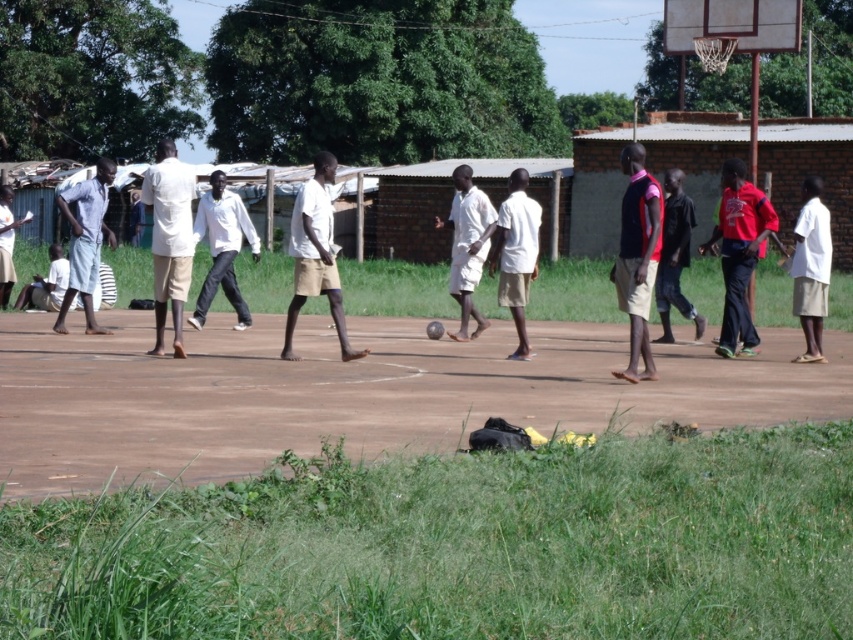
Question: Does brown dirt basketball court at center appear on the left side of dark red shirt at center?

Choices:
 (A) no
 (B) yes

Answer: (B)

Question: Which point is farther from the camera taking this photo?

Choices:
 (A) tap(90, 321)
 (B) tap(157, 244)

Answer: (A)

Question: Which object appears closest to the camera in this image?

Choices:
 (A) light gray cotton shirt at left
 (B) brown dirt basketball court at center

Answer: (B)

Question: Based on their relative distances, which object is nearer to the light gray cotton shirt at left?

Choices:
 (A) brown dirt basketball court at center
 (B) white cotton shirt at left
 (C) red matte shirt at right

Answer: (B)

Question: Does light gray cotton shirt at left appear on the left side of dark red shirt at center?

Choices:
 (A) no
 (B) yes

Answer: (B)

Question: Does brown dirt basketball court at center appear on the left side of dark red shirt at center?

Choices:
 (A) yes
 (B) no

Answer: (A)